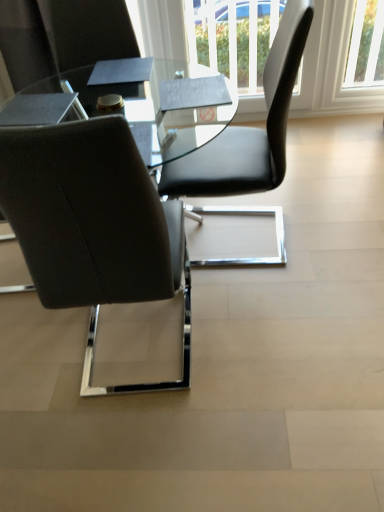
You are a GUI agent. You are given a task and a screenshot of the screen. Output one action in this format:
    pyautogui.click(x=<x>, y=<y>)
    Task: Click on the free space between black leather chair at upper right, acting as the first chair starting from the right, and transparent glass table at center
    
    Given the screenshot: What is the action you would take?
    pyautogui.click(x=251, y=273)